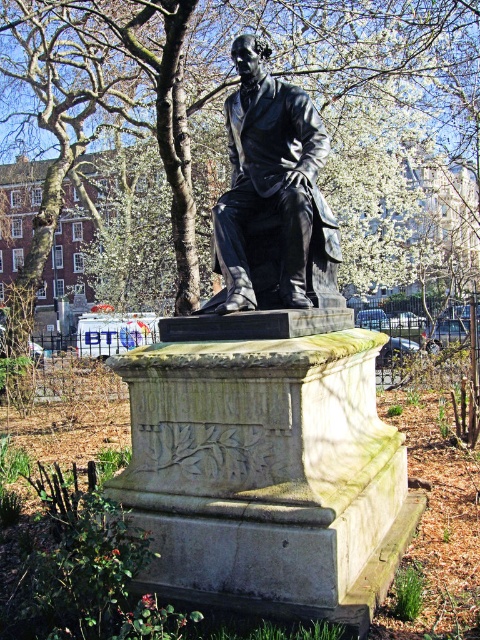
You are a tour guide explaining the statues in the park. You see the polished bronze statue at center and the black polished statue at center. Which one is located to the right of the other?

The polished bronze statue at center is located to the right of the black polished statue at center.

You are a photographer planning to take a picture of the polished bronze statue at center. You want to ensure the green leafy tree at upper left does not block the statue in the photo. Given their sizes, which object should you position closer to the camera to achieve this?

The green leafy tree at upper left is bigger than the polished bronze statue at center. To prevent the tree from blocking the statue, position the statue closer to the camera so its larger size can better frame the statue without obstruction.

You are a photographer planning to capture a wide shot of the black polished statue at center. Considering the green leafy tree at upper left, will the tree block the view of the statue in your photo?

The green leafy tree at upper left has a larger width than the black polished statue at center, so it might block part of the statue in the photo depending on the angle and distance.